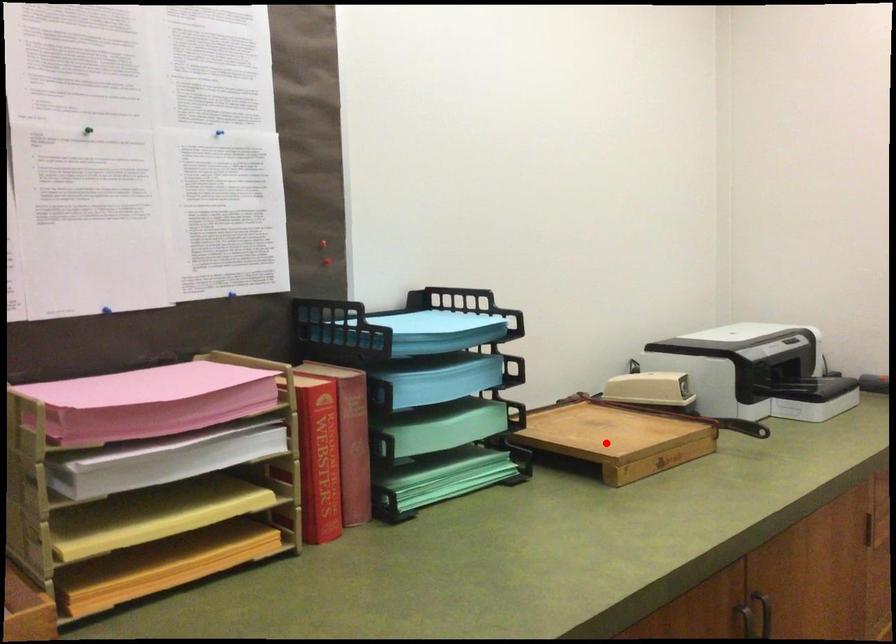
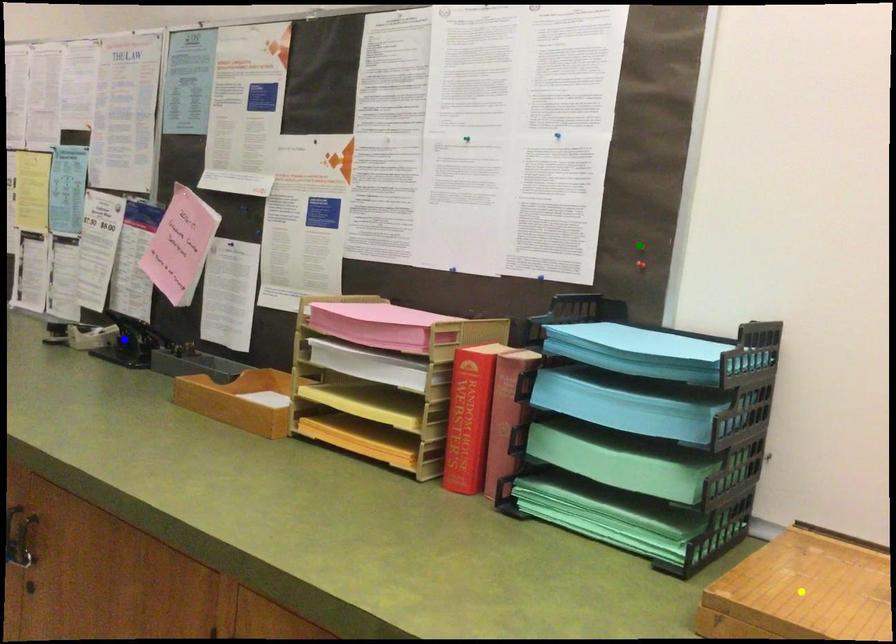
Question: I am providing you with two images of the same scene from different viewpoints. A red point is marked on the first image. You are given multiple points on the second image. Which point in image 2 is actually the same real-world point as the red point in image 1?

Choices:
 (A) yellow point
 (B) green point
 (C) blue point

Answer: (A)